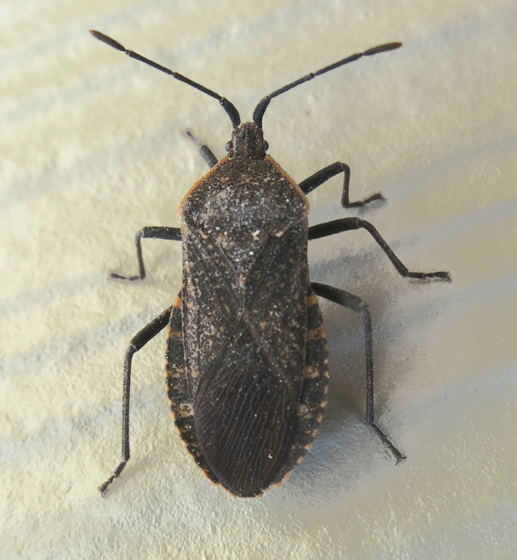
Where is `yellow fabric`? This screenshot has width=517, height=560. yellow fabric is located at coordinates (26, 158), (42, 240), (42, 71), (31, 18), (41, 326), (48, 393), (35, 494), (175, 546).